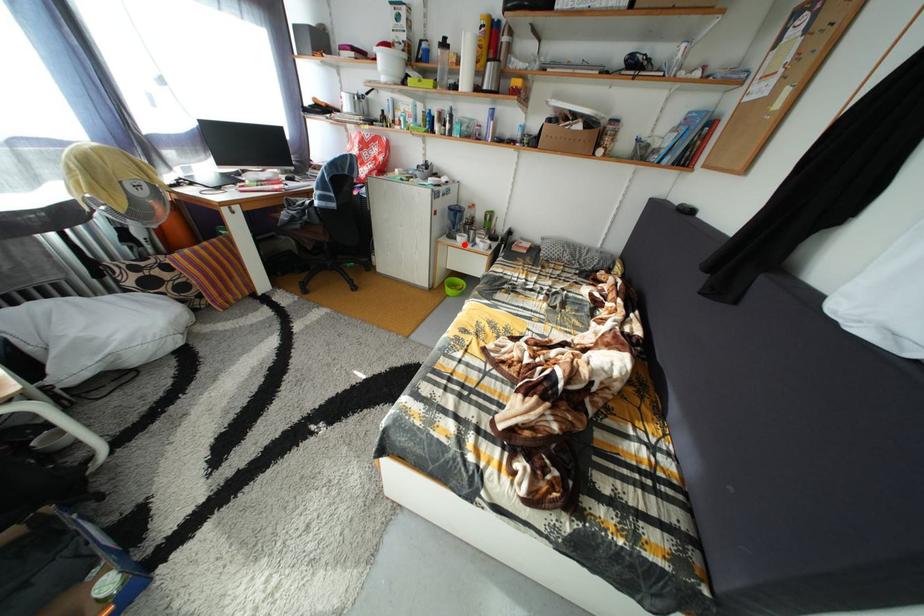
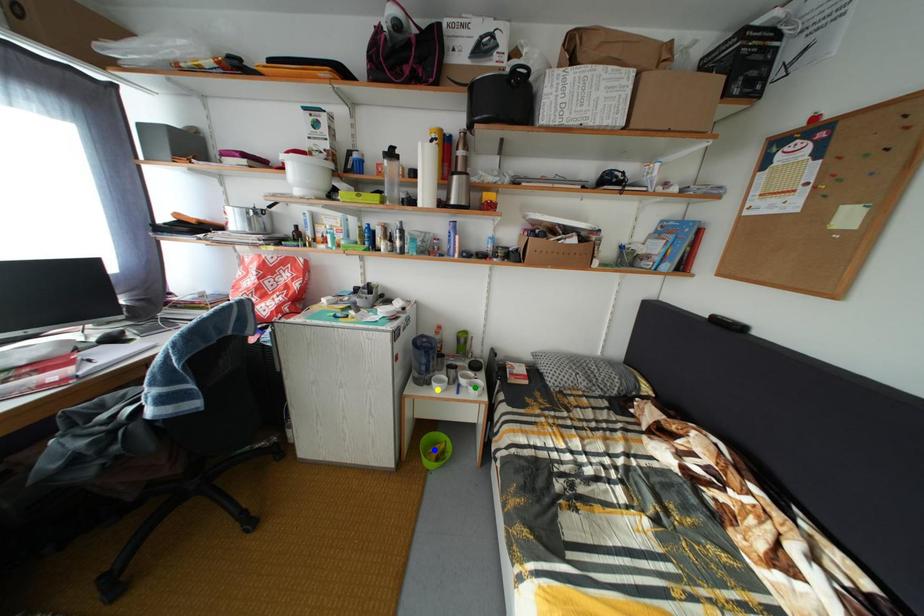
Question: I am providing you with two images of the same scene from different viewpoints. A red point is marked on the first image. You are given multiple points on the second image. In image 2, which mark is for the same physical point as the one in image 1?

Choices:
 (A) green point
 (B) blue point
 (C) yellow point

Answer: (C)